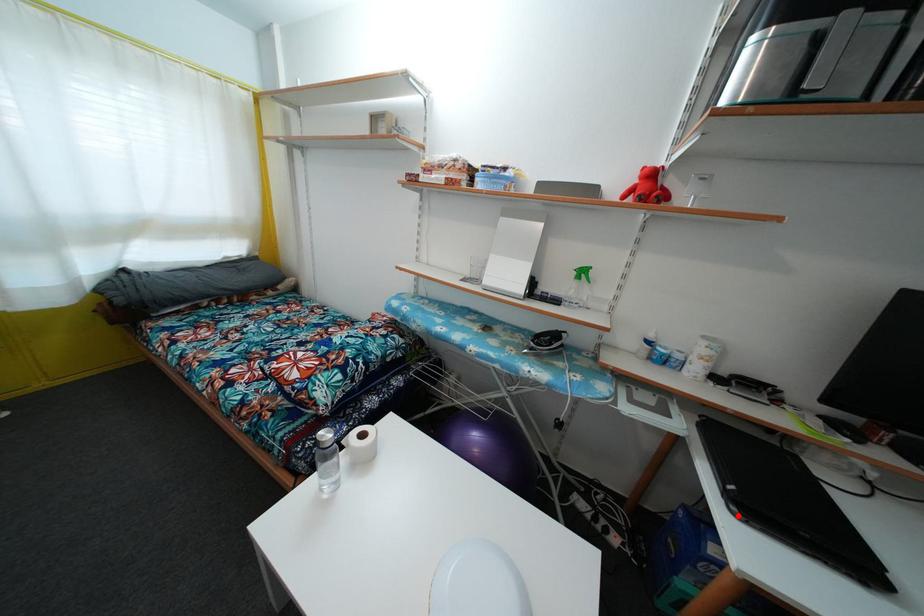
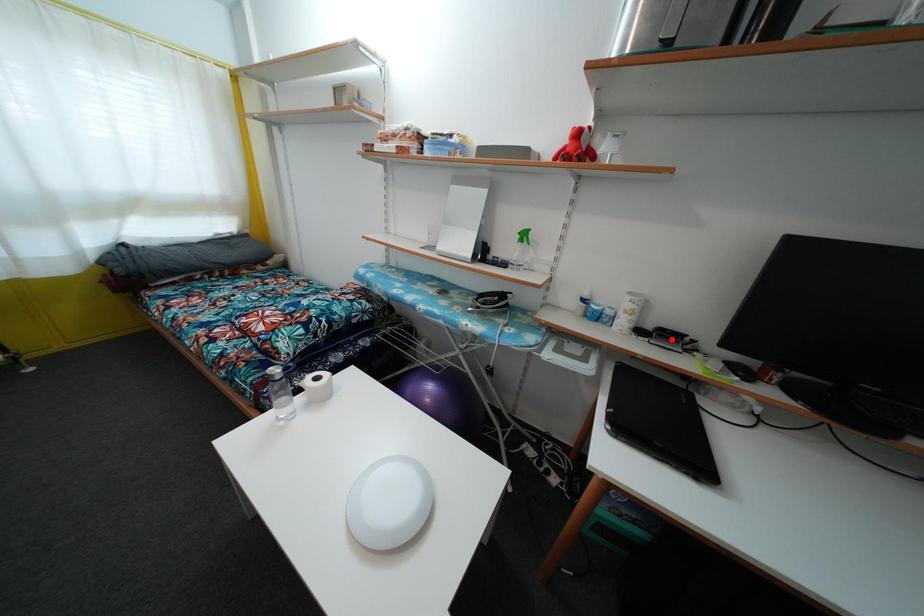
I am providing you with two images of the same scene from different viewpoints. A red point is marked on the first image and another point is marked on the second image. Does the point marked in image1 correspond to the same location as the one in image2?

No